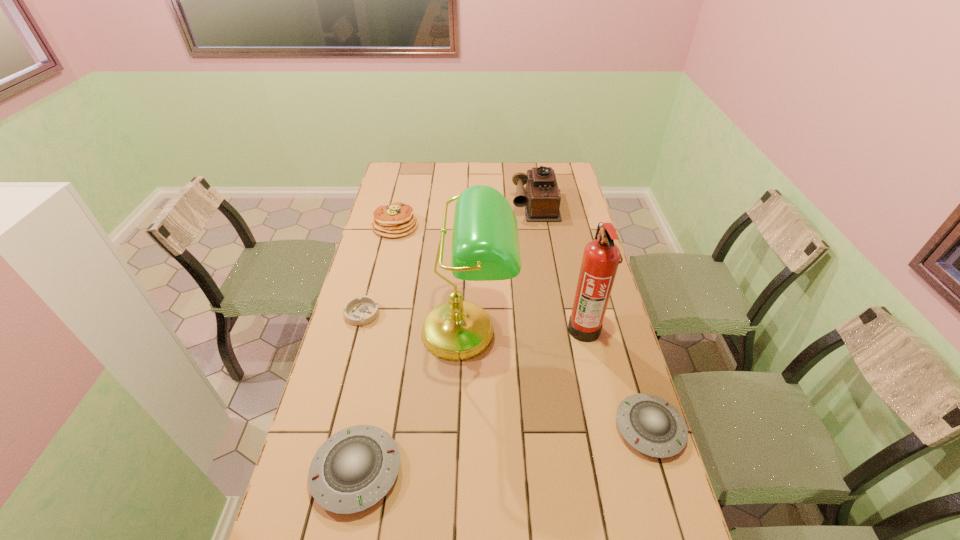
Identify the location of free space between the pancake and the shorter saucer. This screenshot has height=540, width=960. (522, 327).

Identify the location of vacant space in between the ashtray and the pancake. (379, 270).

At what (x,y) coordinates should I click in order to perform the action: click on free space that is in between the second shortest object and the shortest object. Please return your answer as a coordinate pair (x, y). Looking at the image, I should click on (506, 371).

Where is `object that ranks as the fourth closest to the ashtray`? This screenshot has width=960, height=540. object that ranks as the fourth closest to the ashtray is located at coordinates (601, 257).

Choose which object is the second nearest neighbor to the lamp. Please provide its 2D coordinates. Your answer should be formatted as a tuple, i.e. [(x, y)], where the tuple contains the x and y coordinates of a point satisfying the conditions above.

[(360, 463)]

At what (x,y) coordinates should I click in order to perform the action: click on free space that satisfies the following two spatial constraints: 1. on the front side of the fourth tallest object; 2. on the left side of the shorter saucer. Please return your answer as a coordinate pair (x, y). This screenshot has width=960, height=540. Looking at the image, I should click on (348, 428).

At what (x,y) coordinates should I click in order to perform the action: click on free location that satisfies the following two spatial constraints: 1. on the horn of the right saucer; 2. on the left side of the fifth shortest object. Please return your answer as a coordinate pair (x, y). The height and width of the screenshot is (540, 960). Looking at the image, I should click on (571, 428).

This screenshot has width=960, height=540. I want to click on vacant space that satisfies the following two spatial constraints: 1. on the front side of the fourth shortest object; 2. on the right side of the sixth tallest object, so click(348, 428).